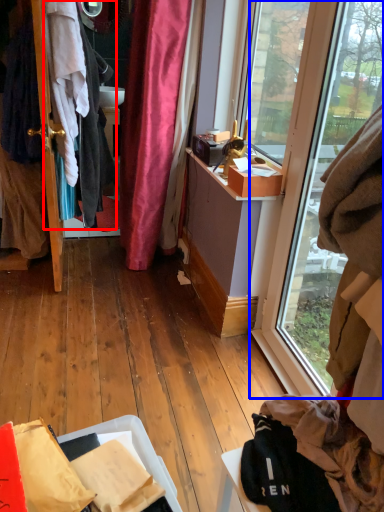
Question: Which point is further to the camera, clothing (highlighted by a red box) or window (highlighted by a blue box)?

Choices:
 (A) clothing
 (B) window

Answer: (A)